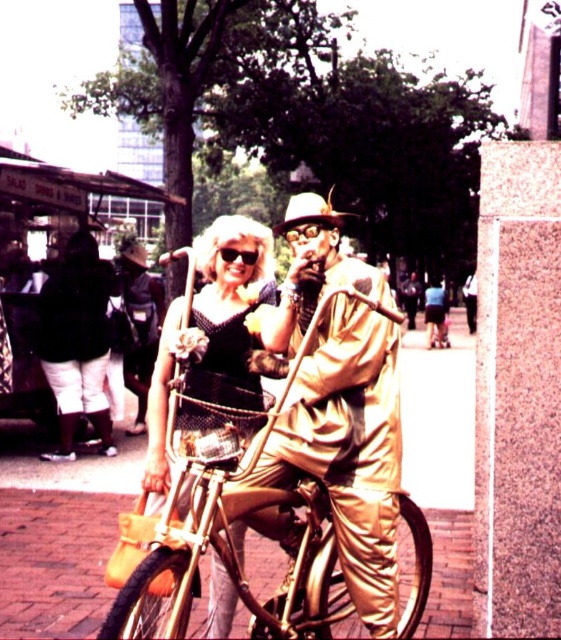
Question: Which point is closer to the camera?

Choices:
 (A) gold metallic suit at center
 (B) shiny gold dress at center

Answer: (B)

Question: Does gold metallic suit at center appear on the right side of gold shiny bicycle at center?

Choices:
 (A) no
 (B) yes

Answer: (B)

Question: Which point appears farthest from the camera in this image?

Choices:
 (A) (x=218, y=221)
 (B) (x=302, y=428)
 (C) (x=347, y=605)

Answer: (C)

Question: Which of the following is the closest to the observer?

Choices:
 (A) gold shiny bicycle at center
 (B) gold metallic suit at center

Answer: (A)

Question: Can you confirm if gold metallic suit at center is positioned below shiny gold dress at center?

Choices:
 (A) yes
 (B) no

Answer: (B)

Question: Does gold metallic suit at center have a smaller size compared to shiny gold dress at center?

Choices:
 (A) no
 (B) yes

Answer: (B)